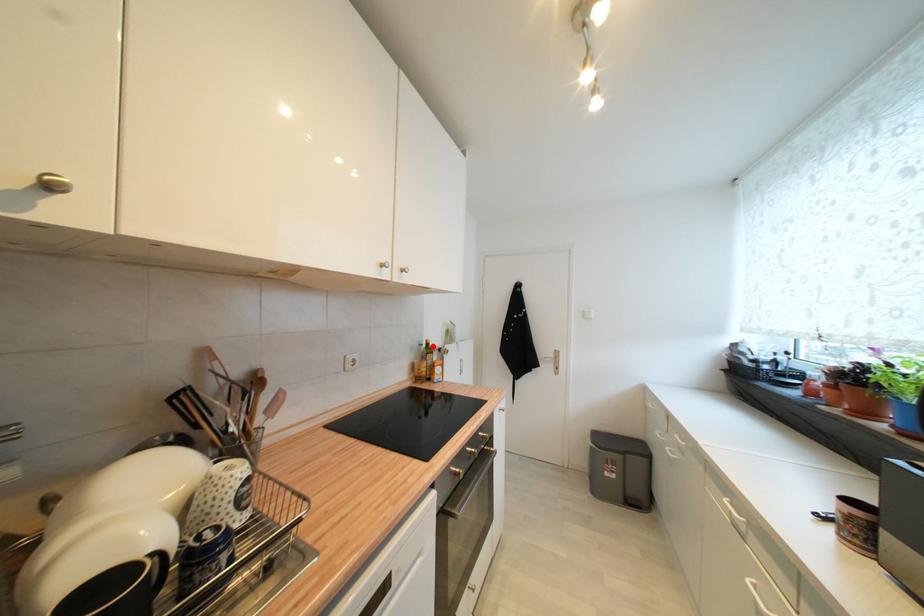
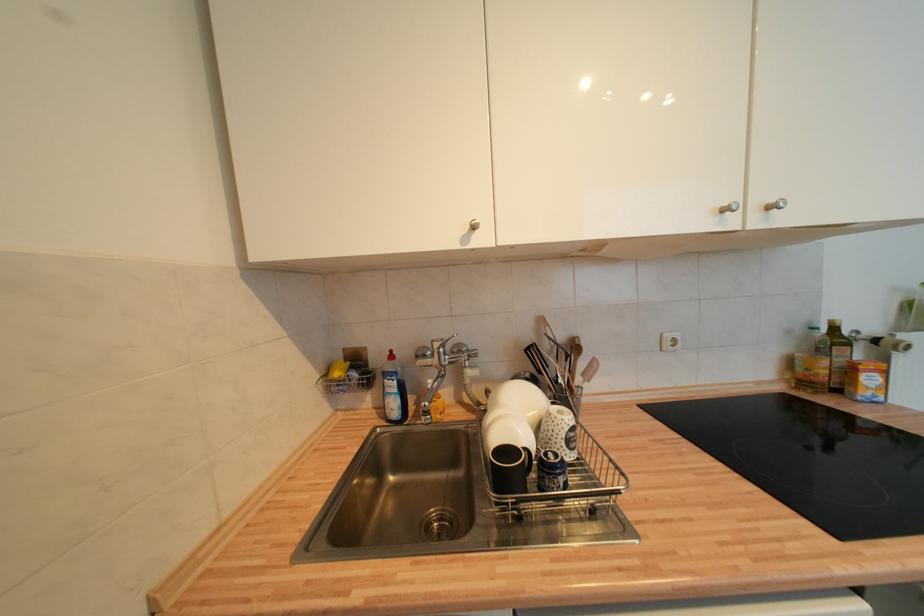
Find the pixel in the second image that matches the highlighted location in the first image.

(840, 331)